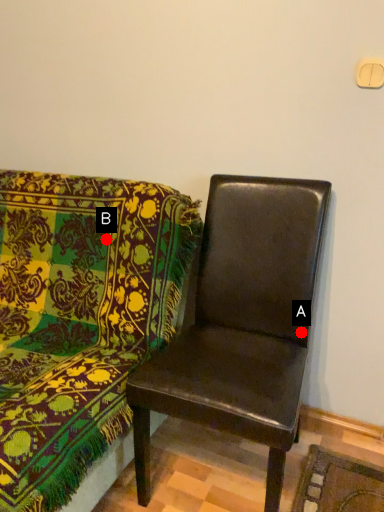
Question: Two points are circled on the image, labeled by A and B beside each circle. Which of the following is the closest to the observer?

Choices:
 (A) A is closer
 (B) B is closer

Answer: (A)